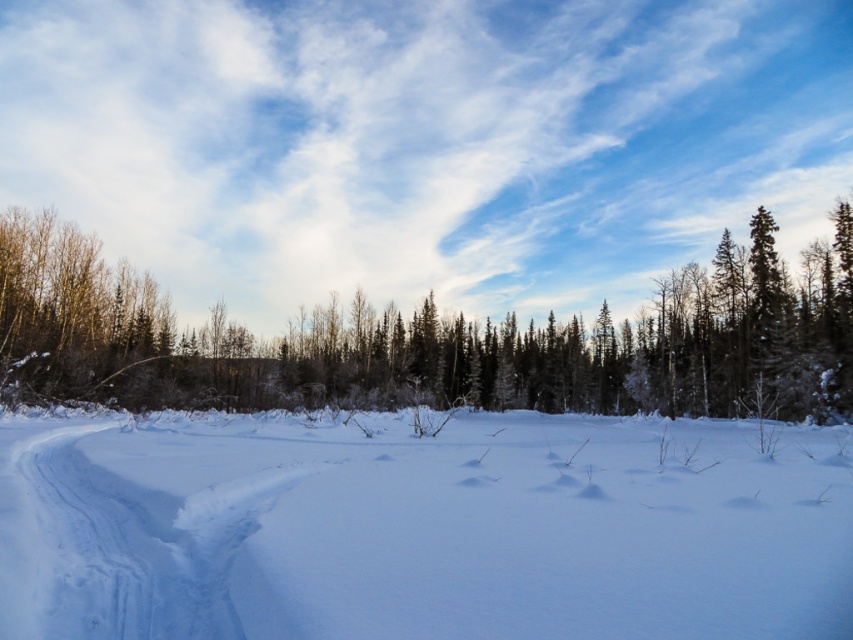
Does white fluffy snow at center have a smaller size compared to snowy evergreen trees at center?

Yes, white fluffy snow at center is smaller than snowy evergreen trees at center.

Who is lower down, white fluffy snow at center or snowy evergreen trees at center?

Positioned lower is white fluffy snow at center.

Is point (90, 458) positioned after point (281, 387)?

No, it is in front of (281, 387).

Locate an element on the screen. This screenshot has width=853, height=640. white fluffy snow at center is located at coordinates (421, 529).